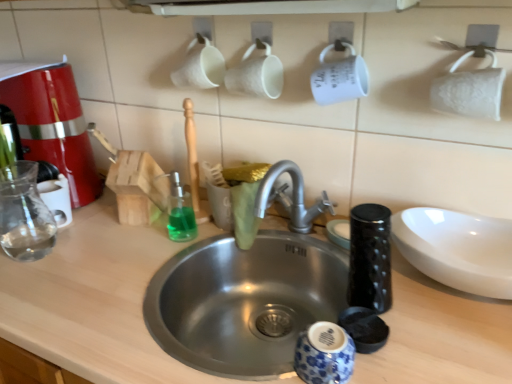
The height and width of the screenshot is (384, 512). I want to click on vacant space to the right of green translucent liquid at sink, so click(x=238, y=238).